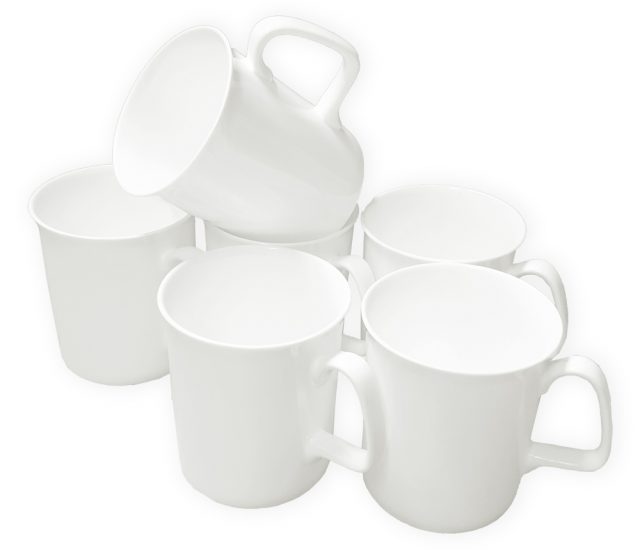
Where is `white mug`? This screenshot has width=640, height=550. white mug is located at coordinates (491, 337), (445, 216), (285, 169), (332, 243), (226, 360), (86, 271).